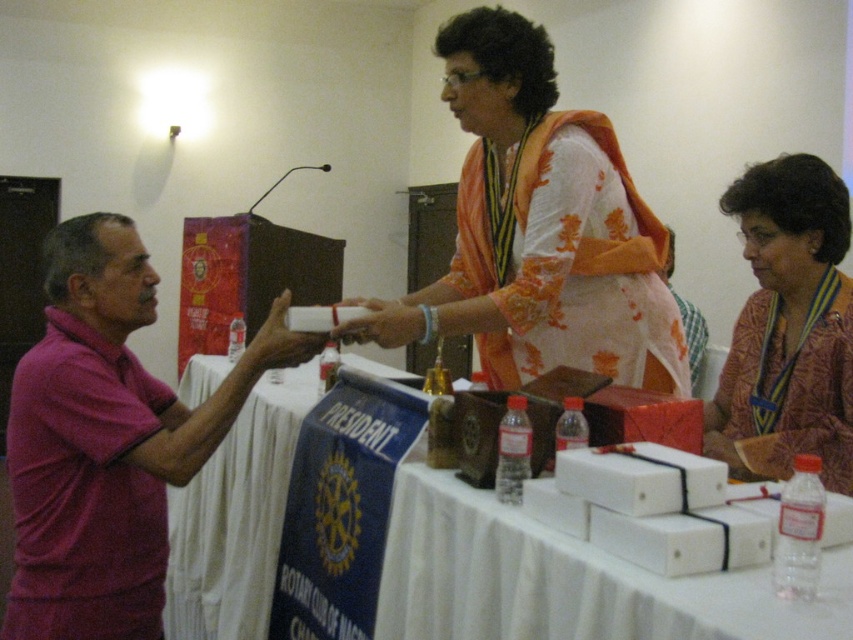
You are attending a Rotary Club event and notice two items on the table. Which item takes up more space visually between the pink shirt at left and the matte white box at center?

The pink shirt at left takes up more space visually than the matte white box at center because it is bigger in size.

You are standing at the entrance of the conference hall and see two points marked on the floor. The first point is labeled as point (428,317) and the second is point (404,308). If you want to walk towards the table in the foreground, which point should you step on first?

You should step on point (428,317) first because it is in front of point (404,308), meaning it is closer to the table in the foreground.